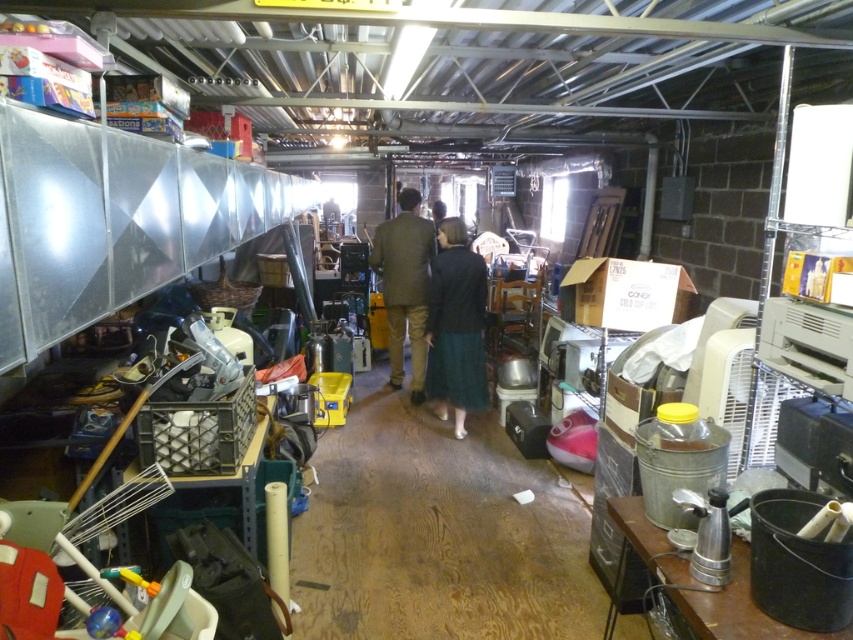
Question: From the image, what is the correct spatial relationship of dark green skirt at center in relation to brown wool coat at center?

Choices:
 (A) above
 (B) below

Answer: (B)

Question: In this image, where is dark green skirt at center located relative to brown wool coat at center?

Choices:
 (A) right
 (B) left

Answer: (A)

Question: Where is dark green skirt at center located in relation to brown wool coat at center in the image?

Choices:
 (A) left
 (B) right

Answer: (B)